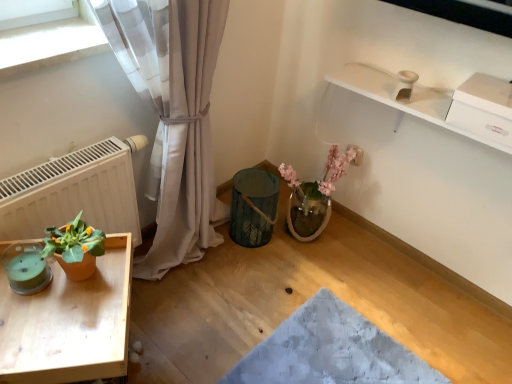
The image size is (512, 384). Describe the element at coordinates (70, 323) in the screenshot. I see `wooden tray at lower left` at that location.

Measure the distance between point (41, 278) and camera.

Point (41, 278) and camera are 3.65 feet apart.

What is the approximate width of terracotta pot at left?

The width of terracotta pot at left is 15.63 centimeters.

The height and width of the screenshot is (384, 512). Identify the location of white matte radiator at left. (74, 192).

At what (x,y) coordinates should I click in order to perform the action: click on wooden tray at lower left. Please return your answer as a coordinate pair (x, y). This screenshot has width=512, height=384. Looking at the image, I should click on (70, 323).

How many degrees apart are the facing directions of white matte radiator at left and terracotta pot at left?

The angle between the facing direction of white matte radiator at left and the facing direction of terracotta pot at left is 0.0873 degrees.

Considering the points (71, 168) and (87, 270), which point is in front, point (71, 168) or point (87, 270)?

Point (87, 270)

Is white matte radiator at left wider than terracotta pot at left?

No, white matte radiator at left is not wider than terracotta pot at left.

Based on the photo, from a real-world perspective, between white matte radiator at left and terracotta pot at left, who is vertically lower?

white matte radiator at left is physically lower.

From the image's perspective, is wooden tray at lower left located beneath teal glass candle at lower left?

Yes, from the image's perspective, wooden tray at lower left is beneath teal glass candle at lower left.

Does point (106, 348) come closer to viewer compared to point (22, 271)?

That is True.

From the picture: Is wooden tray at lower left facing away from teal glass candle at lower left?

No, wooden tray at lower left is not facing away from teal glass candle at lower left.

Is white matte radiator at left next to wooden tray at lower left?

No, white matte radiator at left is not making contact with wooden tray at lower left.

Find the location of a particular element. table below the white matte radiator at left (from the image's perspective) is located at coordinates (70, 323).

Would you consider teal glass candle at lower left to be distant from white matte radiator at left?

teal glass candle at lower left is actually quite close to white matte radiator at left.

From a real-world perspective, who is located higher, teal glass candle at lower left or white matte radiator at left?

teal glass candle at lower left.

Is teal glass candle at lower left turned away from white matte radiator at left?

Yes, teal glass candle at lower left is facing away from white matte radiator at left.

Can you confirm if teal glass candle at lower left is bigger than white matte radiator at left?

Actually, teal glass candle at lower left might be smaller than white matte radiator at left.

In the scene shown: From the image's perspective, which object appears higher, white matte radiator at left or teal glass candle at lower left?

white matte radiator at left.

Where is `teal lying on the left of white matte radiator at left`? Image resolution: width=512 pixels, height=384 pixels. teal lying on the left of white matte radiator at left is located at coordinates [x=26, y=268].

Can you confirm if white matte radiator at left is bigger than teal glass candle at lower left?

Indeed, white matte radiator at left has a larger size compared to teal glass candle at lower left.

In the scene shown: Does white matte radiator at left contain teal glass candle at lower left?

No, teal glass candle at lower left is located outside of white matte radiator at left.

Are wooden tray at lower left and terracotta pot at left beside each other?

No, wooden tray at lower left is not next to terracotta pot at left.

Consider the image. Considering the relative positions of wooden tray at lower left and terracotta pot at left in the image provided, is wooden tray at lower left to the left or to the right of terracotta pot at left?

wooden tray at lower left is positioned on terracotta pot at left's left side.

Who is more distant, wooden tray at lower left or terracotta pot at left?

terracotta pot at left is more distant.

In the scene shown: From a real-world perspective, is terracotta pot at left above or below teal glass candle at lower left?

terracotta pot at left is above teal glass candle at lower left.

Between terracotta pot at left and teal glass candle at lower left, which one has smaller width?

teal glass candle at lower left is thinner.

Does terracotta pot at left turn towards teal glass candle at lower left?

No, terracotta pot at left does not turn towards teal glass candle at lower left.

Is teal glass candle at lower left a part of terracotta pot at left?

No, teal glass candle at lower left is not surrounded by terracotta pot at left.

Where is `radiator above the terracotta pot at left (from the image's perspective)`? The height and width of the screenshot is (384, 512). radiator above the terracotta pot at left (from the image's perspective) is located at coordinates (74, 192).

Where is `table located in front of the teal glass candle at lower left`? This screenshot has height=384, width=512. table located in front of the teal glass candle at lower left is located at coordinates pos(70,323).

Consider the image. From the image, which object appears to be farther from teal glass candle at lower left, white matte radiator at left or terracotta pot at left?

Based on the image, white matte radiator at left appears to be further to teal glass candle at lower left.

Consider the image. When comparing their distances from teal glass candle at lower left, does white matte radiator at left or wooden tray at lower left seem closer?

wooden tray at lower left.

Considering their positions, is terracotta pot at left positioned closer to wooden tray at lower left than teal glass candle at lower left?

terracotta pot at left is positioned closer to the anchor wooden tray at lower left.

Estimate the real-world distances between objects in this image. Which object is further from terracotta pot at left, teal glass candle at lower left or white matte radiator at left?

white matte radiator at left is further to terracotta pot at left.

From the image, which object appears to be farther from white matte radiator at left, terracotta pot at left or wooden tray at lower left?

wooden tray at lower left.

Which object lies further to the anchor point wooden tray at lower left, teal glass candle at lower left or white matte radiator at left?

Based on the image, white matte radiator at left appears to be further to wooden tray at lower left.

Estimate the real-world distances between objects in this image. Which object is closer to terracotta pot at left, teal glass candle at lower left or wooden tray at lower left?

Among the two, teal glass candle at lower left is located nearer to terracotta pot at left.

Which object lies further to the anchor point white matte radiator at left, teal glass candle at lower left or wooden tray at lower left?

Based on the image, wooden tray at lower left appears to be further to white matte radiator at left.

This screenshot has height=384, width=512. I want to click on teal that lies between white matte radiator at left and wooden tray at lower left from top to bottom, so click(26, 268).

Locate an element on the screen. The width and height of the screenshot is (512, 384). radiator between teal glass candle at lower left and terracotta pot at left in the horizontal direction is located at coordinates (74, 192).

I want to click on houseplant that lies between white matte radiator at left and wooden tray at lower left from top to bottom, so click(75, 247).

Locate an element on the screen. teal between terracotta pot at left and wooden tray at lower left in the vertical direction is located at coordinates (26, 268).